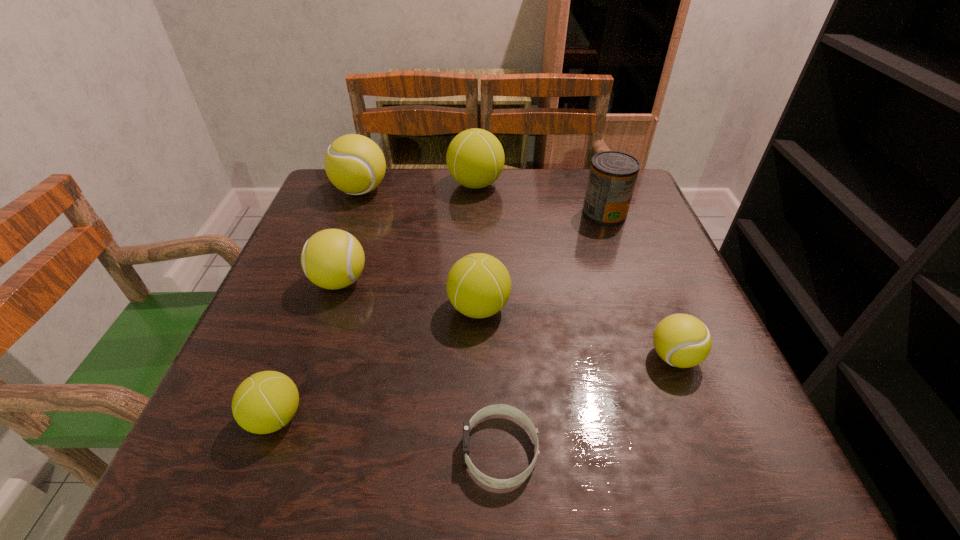
The width and height of the screenshot is (960, 540). I want to click on can that is at the far edge, so click(x=612, y=177).

Find the location of `tennis ball present at the near edge`. tennis ball present at the near edge is located at coordinates (266, 401).

You are a GUI agent. You are given a task and a screenshot of the screen. Output one action in this format:
    pyautogui.click(x=<x>, y=<y>)
    Task: Click on the wristband that is at the near edge
    This screenshot has width=960, height=540.
    Given the screenshot: What is the action you would take?
    pyautogui.click(x=493, y=409)

Locate an element on the screen. This screenshot has width=960, height=540. can present at the right edge is located at coordinates (612, 177).

This screenshot has width=960, height=540. Identify the location of tennis ball that is at the right edge. (681, 340).

Find the location of a particular element. object that is at the far left corner is located at coordinates (354, 164).

Where is `object present at the near left corner`? Image resolution: width=960 pixels, height=540 pixels. object present at the near left corner is located at coordinates (266, 401).

The image size is (960, 540). I want to click on object that is positioned at the far right corner, so click(x=612, y=177).

Where is `vacant space at the far edge of the desktop`? The width and height of the screenshot is (960, 540). vacant space at the far edge of the desktop is located at coordinates (530, 174).

In the image, there is a desktop. Identify the location of vacant space at the near edge. (345, 453).